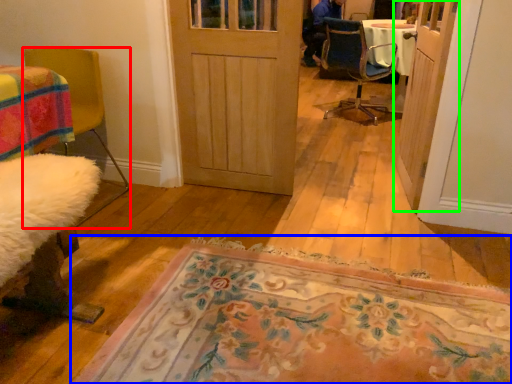
Question: Which object is positioned farthest from chair (highlighted by a red box)? Select from mat (highlighted by a blue box) and door (highlighted by a green box).

Choices:
 (A) mat
 (B) door

Answer: (B)